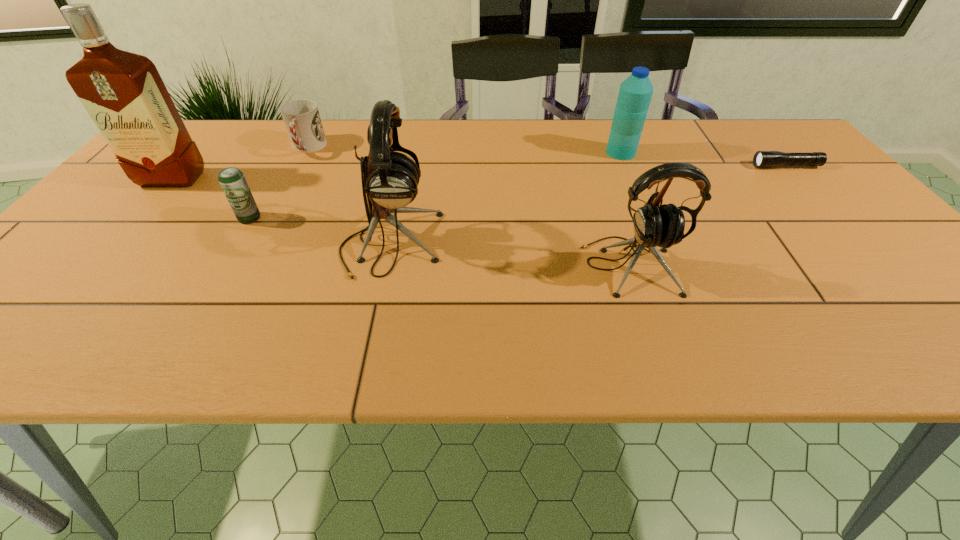
You are a GUI agent. You are given a task and a screenshot of the screen. Output one action in this format:
    pyautogui.click(x=<x>, y=<y>)
    Task: Click on the cup situated at the far edge
    The height and width of the screenshot is (540, 960).
    Given the screenshot: What is the action you would take?
    pyautogui.click(x=301, y=117)

Locate an element on the screen. The image size is (960, 540). object located in the near edge section of the desktop is located at coordinates (663, 226).

At what (x,y) coordinates should I click in order to perform the action: click on object that is at the left edge. Please return your answer as a coordinate pair (x, y). Looking at the image, I should click on (123, 92).

The width and height of the screenshot is (960, 540). Find the location of `object present at the right edge`. object present at the right edge is located at coordinates (761, 158).

This screenshot has height=540, width=960. Identify the location of blank space at the far edge. (583, 145).

Where is `vacant space at the near edge`? Image resolution: width=960 pixels, height=540 pixels. vacant space at the near edge is located at coordinates (862, 316).

In the image, there is a desktop. Identify the location of vacant space at the left edge. The width and height of the screenshot is (960, 540). (99, 225).

The image size is (960, 540). I want to click on vacant space at the right edge, so click(847, 196).

At what (x,y) coordinates should I click in order to perform the action: click on free space between the rightmost object and the liquor. Please return your answer as a coordinate pair (x, y). Looking at the image, I should click on click(x=479, y=172).

Locate an element on the screen. The height and width of the screenshot is (540, 960). vacant area between the cup and the leftmost object is located at coordinates (240, 164).